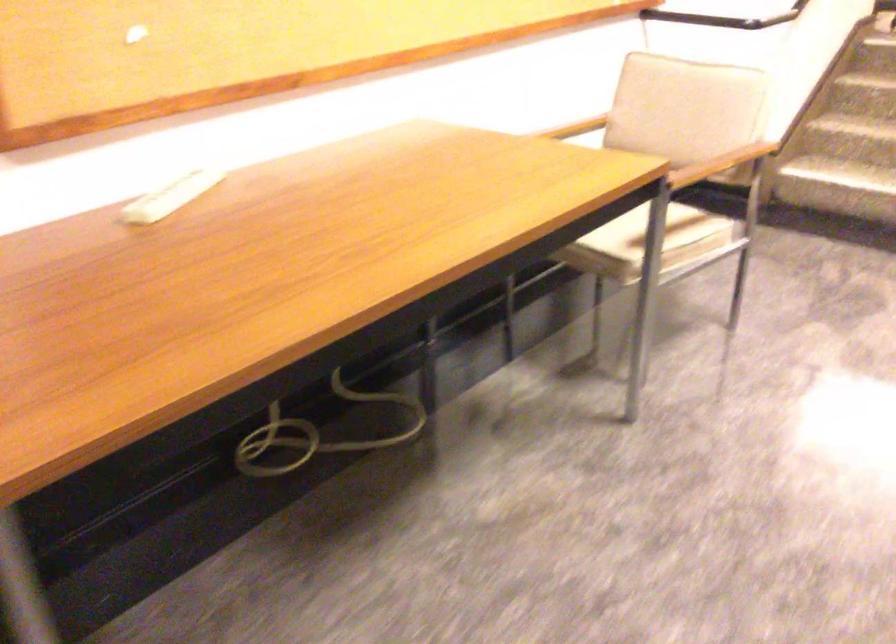
The width and height of the screenshot is (896, 644). What do you see at coordinates (317, 433) in the screenshot?
I see `the coiled yellow cord` at bounding box center [317, 433].